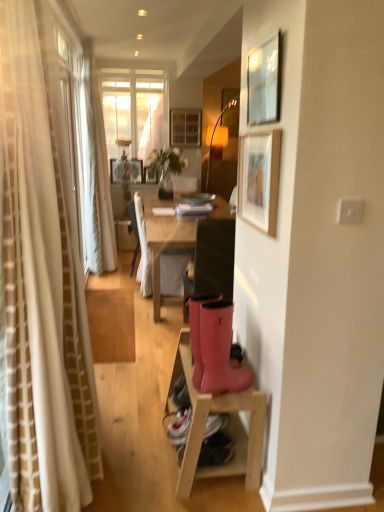
Question: Considering the relative positions of wooden picture frame at center, marked as the second picture frame in a left-to-right arrangement, and rubber boots at lower center in the image provided, is wooden picture frame at center, marked as the second picture frame in a left-to-right arrangement, to the right of rubber boots at lower center from the viewer's perspective?

Choices:
 (A) no
 (B) yes

Answer: (A)

Question: Is wooden picture frame at center, the fourth picture frame positioned from the front, beside rubber boots at lower center?

Choices:
 (A) no
 (B) yes

Answer: (A)

Question: Is wooden picture frame at center, the 1th picture frame viewed from the back, turned away from rubber boots at lower center?

Choices:
 (A) yes
 (B) no

Answer: (B)

Question: Does wooden picture frame at center, the 3th picture frame from the bottom, turn towards rubber boots at lower center?

Choices:
 (A) no
 (B) yes

Answer: (B)

Question: Is wooden picture frame at center, the fourth picture frame positioned from the front, completely or partially outside of rubber boots at lower center?

Choices:
 (A) yes
 (B) no

Answer: (A)

Question: Is wooden picture frame at center, the 1th picture frame viewed from the back, to the left of rubber boots at lower center from the viewer's perspective?

Choices:
 (A) yes
 (B) no

Answer: (A)

Question: Can you confirm if wooden stool at lower right is bigger than rubber boots at lower center?

Choices:
 (A) yes
 (B) no

Answer: (A)

Question: Considering the relative sizes of wooden stool at lower right and rubber boots at lower center in the image provided, is wooden stool at lower right taller than rubber boots at lower center?

Choices:
 (A) no
 (B) yes

Answer: (B)

Question: Is wooden stool at lower right smaller than rubber boots at lower center?

Choices:
 (A) yes
 (B) no

Answer: (B)

Question: From a real-world perspective, is wooden stool at lower right under rubber boots at lower center?

Choices:
 (A) yes
 (B) no

Answer: (A)

Question: Is wooden stool at lower right located outside rubber boots at lower center?

Choices:
 (A) no
 (B) yes

Answer: (B)

Question: Is wooden stool at lower right facing towards rubber boots at lower center?

Choices:
 (A) yes
 (B) no

Answer: (B)

Question: From a real-world perspective, is metallic silver picture frame at upper right, acting as the 1th picture frame starting from the right, physically below wooden picture frame at center, the fourth picture frame positioned from the front?

Choices:
 (A) no
 (B) yes

Answer: (A)